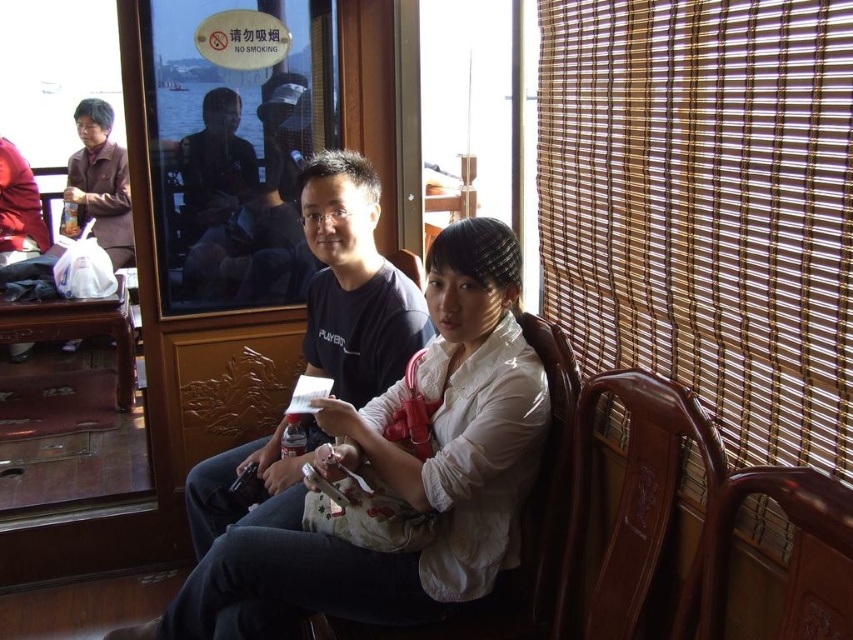
Consider the image. Can you confirm if white matte shirt at center is wider than brown wooden chair at right?

Indeed, white matte shirt at center has a greater width compared to brown wooden chair at right.

Which is below, white matte shirt at center or brown wooden chair at right?

white matte shirt at center is lower down.

Is point (300, 490) behind point (842, 522)?

Yes, point (300, 490) is behind point (842, 522).

You are a GUI agent. You are given a task and a screenshot of the screen. Output one action in this format:
    pyautogui.click(x=<x>, y=<y>)
    Task: Click on the white matte shirt at center
    The height and width of the screenshot is (640, 853).
    Given the screenshot: What is the action you would take?
    pyautogui.click(x=398, y=476)

Describe the element at coordinates (235, 145) in the screenshot. I see `transparent glass window at upper center` at that location.

Is transparent glass window at upper center wider than black matte shirt at center?

No, transparent glass window at upper center is not wider than black matte shirt at center.

Measure the distance between transparent glass window at upper center and camera.

A distance of 2.11 meters exists between transparent glass window at upper center and camera.

In order to click on transparent glass window at upper center in this screenshot , I will do `click(235, 145)`.

Between point (364, 227) and point (817, 602), which one is positioned behind?

The point (364, 227) is behind.

Locate an element on the screen. black matte shirt at center is located at coordinates (354, 284).

Is point (265, 516) positioned in front of point (727, 572)?

No, (265, 516) is behind (727, 572).

Locate an element on the screen. The height and width of the screenshot is (640, 853). black matte shirt at center is located at coordinates (354, 284).